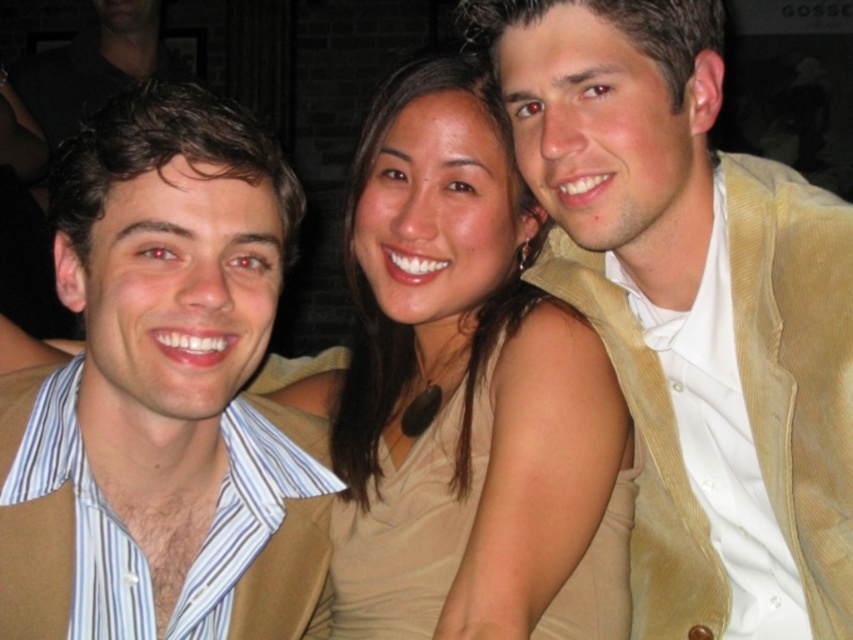
You are standing at the point marked by coordinates point (90,625) and want to take a photo of the three people in the scene. The camera you have can focus on subjects within 10 feet. Will the camera be able to capture the three people clearly?

The distance between point (90,625) and the camera is 9.72 feet, which is within the camera focus range of 10 feet. Therefore, the camera can capture the three people clearly.

You are a photographer trying to adjust the lighting for a group photo. You notice two vests in the image, the tan corduroy vest at center and the matte brown vest at left. Which vest is positioned to the right side of the other?

The tan corduroy vest at center is positioned to the right of the matte brown vest at left.

You are standing in front of a group photo of three people. You need to determine which piece of clothing is closer to you between the matte brown vest at left and the matte beige dress at center. Which one is closer?

The matte brown vest at left is closer to you because it is further to the viewer than the matte beige dress at center.